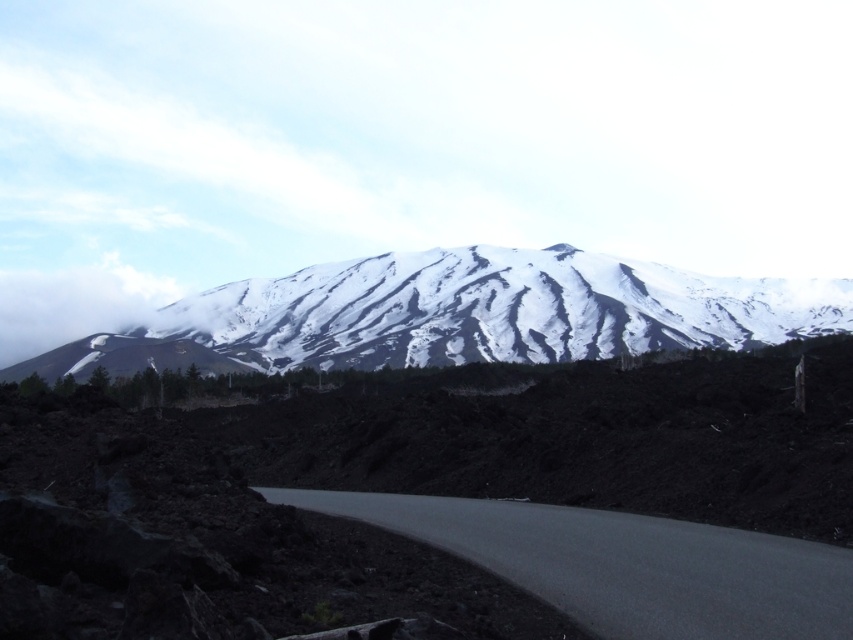
Question: Is snowy volcanic peak at center bigger than white fluffy cloud at upper left?

Choices:
 (A) yes
 (B) no

Answer: (B)

Question: Is snowy volcanic peak at center further to camera compared to white fluffy cloud at upper left?

Choices:
 (A) yes
 (B) no

Answer: (B)

Question: Which of the following is the farthest from the observer?

Choices:
 (A) (848, 616)
 (B) (843, 321)

Answer: (B)

Question: Does black asphalt road at center appear on the right side of white fluffy cloud at upper left?

Choices:
 (A) no
 (B) yes

Answer: (B)

Question: Which point is closer to the camera?

Choices:
 (A) white fluffy cloud at upper left
 (B) snowy volcanic peak at center
 (C) black asphalt road at center

Answer: (C)

Question: Which object is the farthest from the white fluffy cloud at upper left?

Choices:
 (A) snowy volcanic peak at center
 (B) black asphalt road at center

Answer: (B)